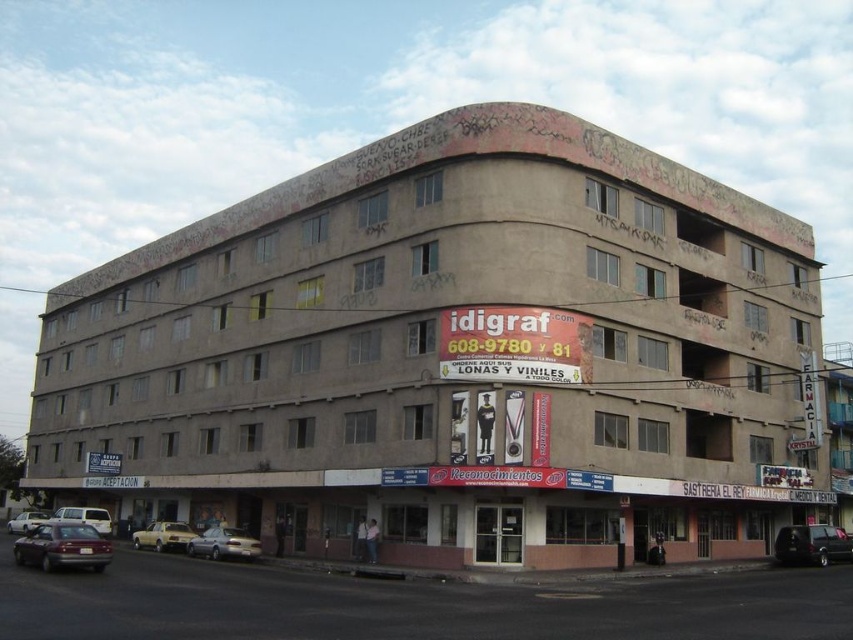
You are standing at the corner of the street where the multi story building is located. You want to park your car in a spot that is at least 1.5 meters away from any other vehicles. Is there enough space between the matte red car at lower left and the building wall?

The matte red car at lower left is located at point (62, 547). However, there is no information provided about the distance between the car and the building wall, so it is impossible to determine if there is enough space to park 1.5 meters away from it.

You are standing in front of the multi story building at the street corner. You see two points marked on the building facade. The first point is at coordinate (26, 536) and the second point is at coordinate (24, 513). Which point is closer to you?

The point at coordinate (26, 536) is closer to you than the point at coordinate (24, 513).

You are a delivery person trying to park a truck that is 2 meters wide. You see a matte red car at lower left and a yellow matte car at lower left. Can you determine if there is enough space between them to park your truck?

The matte red car at lower left might be wider than yellow matte car at lower left, so it is uncertain if there is enough space between them to park a 2 meter wide truck. Check the actual width before deciding.